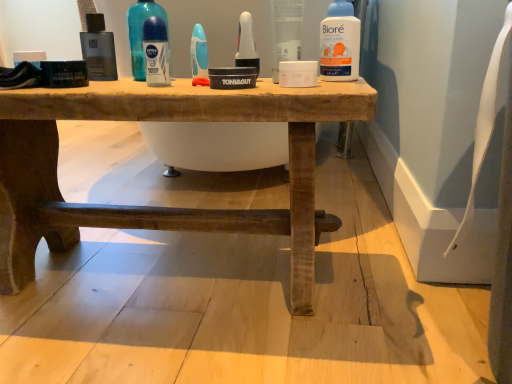
This screenshot has height=384, width=512. What are the coordinates of `vacant space underneath rustic wood table at center (from a real-world perspective)` in the screenshot? It's located at (167, 268).